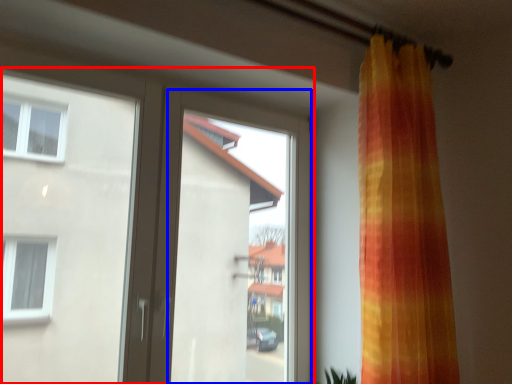
Question: Among these objects, which one is nearest to the camera, door (highlighted by a red box) or window screen (highlighted by a blue box)?

Choices:
 (A) door
 (B) window screen

Answer: (A)